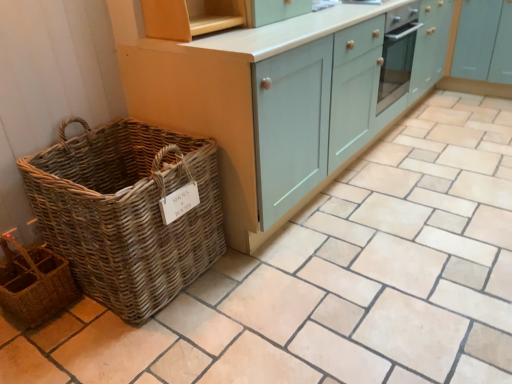
Question: Should I look upward or downward to see matte teal cabinet at center, which is counted as the first cabinetry, starting from the left?

Choices:
 (A) up
 (B) down

Answer: (A)

Question: Is woven brown basket at left thinner than rustic wicker basket at lower left?

Choices:
 (A) no
 (B) yes

Answer: (A)

Question: Is woven brown basket at left far away from rustic wicker basket at lower left?

Choices:
 (A) no
 (B) yes

Answer: (A)

Question: Would you say rustic wicker basket at lower left is part of woven brown basket at left's contents?

Choices:
 (A) yes
 (B) no

Answer: (B)

Question: Is rustic wicker basket at lower left at the back of woven brown basket at left?

Choices:
 (A) no
 (B) yes

Answer: (A)

Question: From the image's perspective, is woven brown basket at left under rustic wicker basket at lower left?

Choices:
 (A) no
 (B) yes

Answer: (A)

Question: Can you confirm if woven brown basket at left is positioned to the right of rustic wicker basket at lower left?

Choices:
 (A) yes
 (B) no

Answer: (A)

Question: Is woven brown basket at left surrounding light blue wood cabinet at upper right, which is counted as the first cabinetry, starting from the right?

Choices:
 (A) yes
 (B) no

Answer: (B)

Question: From a real-world perspective, is woven brown basket at left over light blue wood cabinet at upper right, which ranks as the second cabinetry in left-to-right order?

Choices:
 (A) no
 (B) yes

Answer: (A)

Question: Considering the relative sizes of woven brown basket at left and light blue wood cabinet at upper right, which ranks as the second cabinetry in left-to-right order, in the image provided, is woven brown basket at left shorter than light blue wood cabinet at upper right, which ranks as the second cabinetry in left-to-right order,?

Choices:
 (A) yes
 (B) no

Answer: (A)

Question: From a real-world perspective, is woven brown basket at left positioned under light blue wood cabinet at upper right, which ranks as the second cabinetry in left-to-right order, based on gravity?

Choices:
 (A) yes
 (B) no

Answer: (A)

Question: Is woven brown basket at left further to camera compared to light blue wood cabinet at upper right, which ranks as the second cabinetry in left-to-right order?

Choices:
 (A) no
 (B) yes

Answer: (A)

Question: Would you say woven brown basket at left is a long distance from light blue wood cabinet at upper right, which is counted as the first cabinetry, starting from the right?

Choices:
 (A) no
 (B) yes

Answer: (B)

Question: Is matte teal cabinet at center, which is counted as the first cabinetry, starting from the left, positioned with its back to rustic wicker basket at lower left?

Choices:
 (A) no
 (B) yes

Answer: (A)